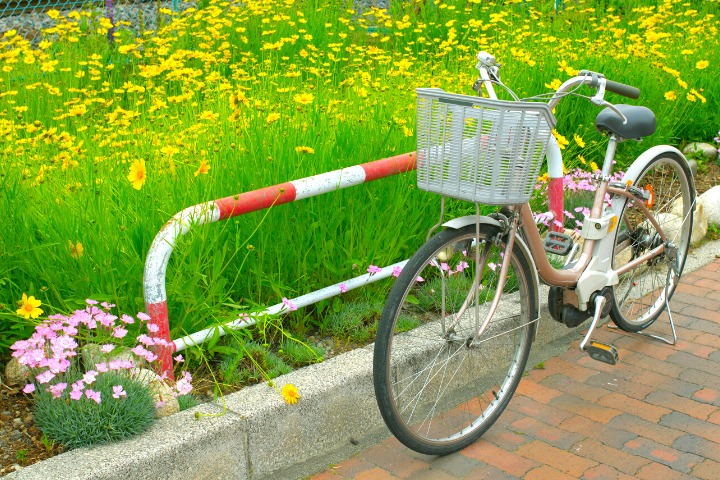
Identify the location of seat. (636, 123).